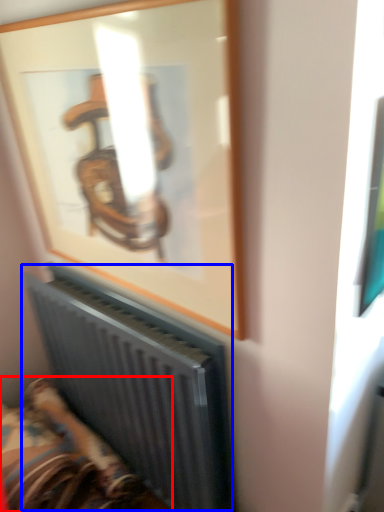
Question: Which object appears farthest to the camera in this image, furniture (highlighted by a red box) or radiator (highlighted by a blue box)?

Choices:
 (A) furniture
 (B) radiator

Answer: (A)